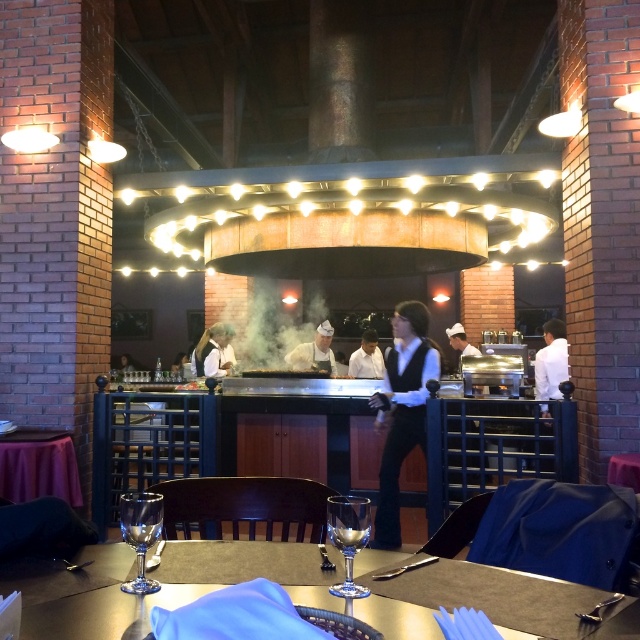
You are a waiter in the restaurant and need to place a new glass at the exact center of the table. The table has coordinates from 0 to 1 on both axes. Where should you place the new glass to match the position of the shiny glassware at center?

The shiny glassware at center is located at coordinates point [160,580], so you should place the new glass at point [160,580] to match its position.